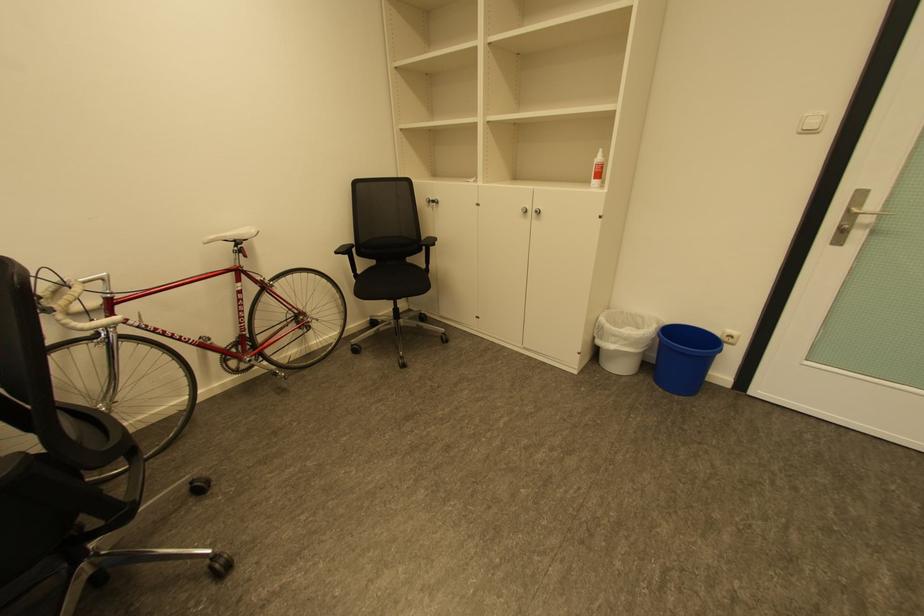
I want to click on chair sitting surface, so click(x=392, y=281).